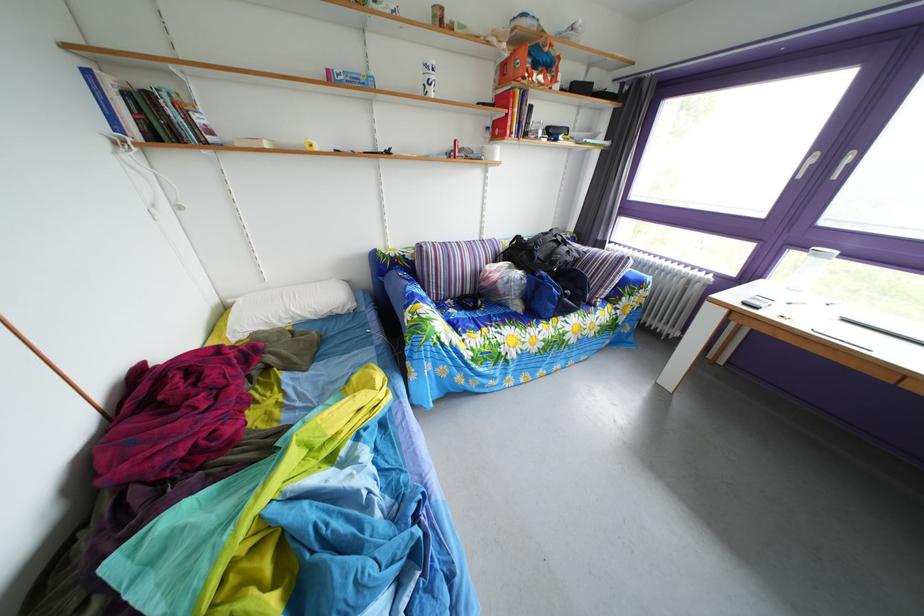
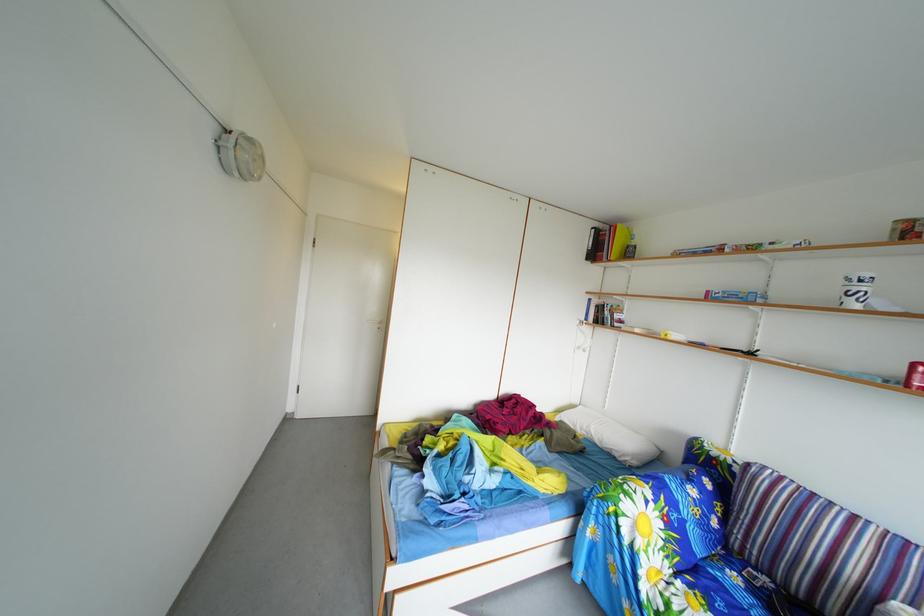
The point at (326, 323) is marked in the first image. Where is the corresponding point in the second image?

(612, 451)